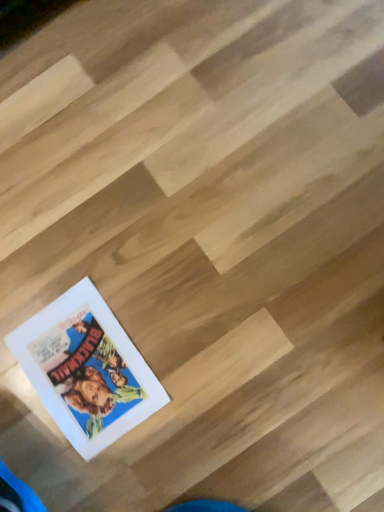
The height and width of the screenshot is (512, 384). Identify the location of free space in front of matte paper book at bottom left. (169, 454).